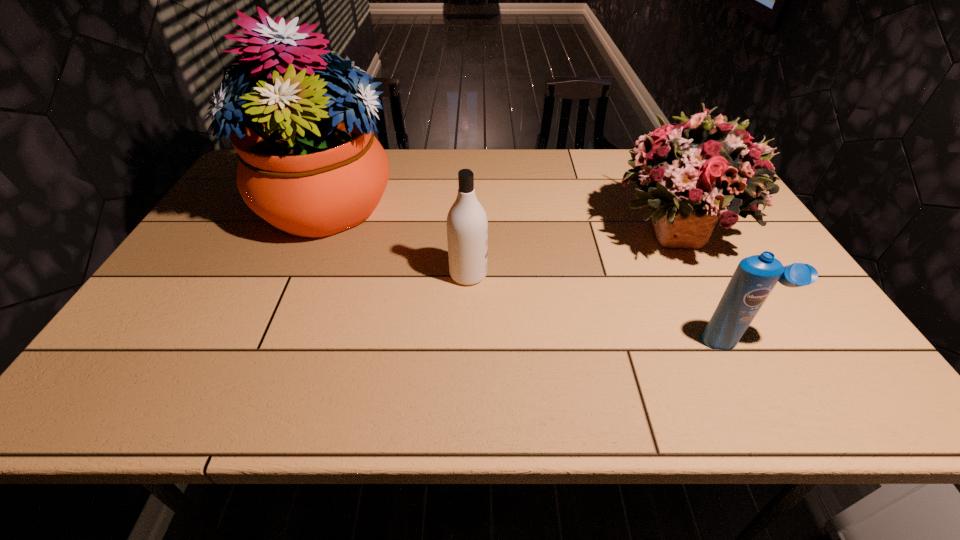
Where is `blank area located 0.320m on the back of the shortest object`? This screenshot has height=540, width=960. blank area located 0.320m on the back of the shortest object is located at coordinates (682, 240).

Identify the location of object that is positioned at the far edge. This screenshot has width=960, height=540. (310, 165).

Identify the location of object that is at the left edge. (310, 165).

At what (x,y) coordinates should I click in order to perform the action: click on bouquet that is at the right edge. Please return your answer as a coordinate pair (x, y). The width and height of the screenshot is (960, 540). Looking at the image, I should click on (692, 172).

Where is `shampoo situated at the right edge`? shampoo situated at the right edge is located at coordinates (755, 277).

Identify the location of object that is at the far left corner. (310, 165).

In the image, there is a desktop. Identify the location of vacant region at the far edge. (511, 163).

Image resolution: width=960 pixels, height=540 pixels. I want to click on free space at the near edge of the desktop, so click(x=569, y=383).

The height and width of the screenshot is (540, 960). I want to click on free location at the left edge, so click(208, 289).

The image size is (960, 540). In order to click on vacant point located between the shortest object and the bouquet in this screenshot , I will do `click(703, 285)`.